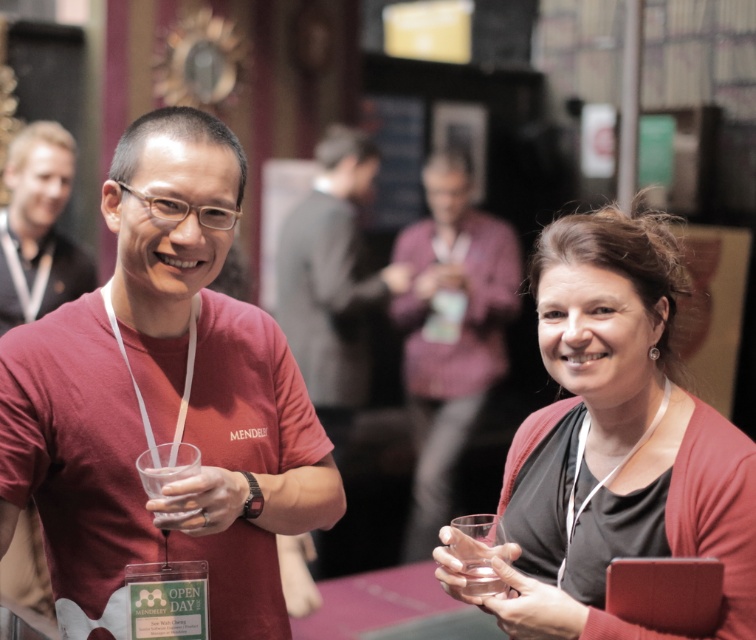
Is matte black shirt at center to the left of clear glass at right from the viewer's perspective?

Incorrect, matte black shirt at center is not on the left side of clear glass at right.

Can you confirm if matte black shirt at center is positioned to the right of clear glass at right?

Yes, matte black shirt at center is to the right of clear glass at right.

Which is behind, point (476, 413) or point (471, 515)?

The point (476, 413) is behind.

I want to click on matte black shirt at center, so click(451, 332).

Is point (485, 385) in front of point (181, 472)?

No, it is not.

Can you confirm if matte black shirt at center is taller than translucent plastic cup at center?

Yes.

Between point (429, 433) and point (194, 467), which one is positioned in front?

Positioned in front is point (194, 467).

This screenshot has width=756, height=640. I want to click on matte black shirt at center, so click(x=451, y=332).

Which is below, matte black cardigan at right or matte red shirt at center?

Positioned lower is matte black cardigan at right.

Who is taller, matte black cardigan at right or matte red shirt at center?

Standing taller between the two is matte red shirt at center.

At what (x,y) coordinates should I click in order to perform the action: click on matte black cardigan at right. Please return your answer as a coordinate pair (x, y). This screenshot has height=640, width=756. Looking at the image, I should click on (614, 442).